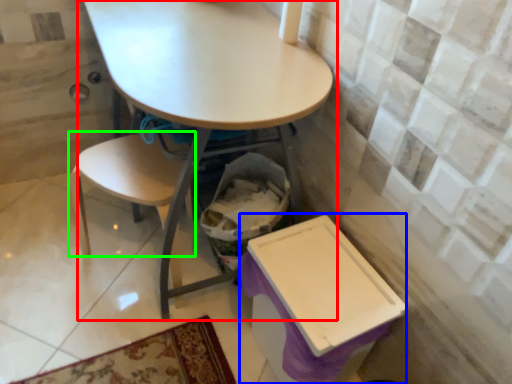
Question: Based on their relative distances, which object is nearer to table (highlighted by a red box)? Choose from box (highlighted by a blue box) and chair (highlighted by a green box).

Choices:
 (A) box
 (B) chair

Answer: (B)